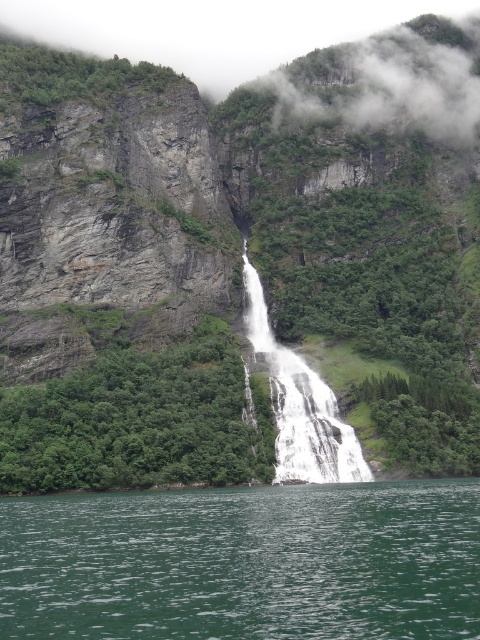
Question: Observing the image, what is the correct spatial positioning of green liquid water at center in reference to white smooth waterfall at center?

Choices:
 (A) above
 (B) below

Answer: (B)

Question: Does green liquid water at center appear under white smooth waterfall at center?

Choices:
 (A) no
 (B) yes

Answer: (B)

Question: Which point appears closest to the camera in this image?

Choices:
 (A) (252, 330)
 (B) (72, 579)

Answer: (B)

Question: Which object appears farthest from the camera in this image?

Choices:
 (A) white smooth waterfall at center
 (B) green liquid water at center

Answer: (A)

Question: Can you confirm if green liquid water at center is bigger than white smooth waterfall at center?

Choices:
 (A) no
 (B) yes

Answer: (A)

Question: Which point is closer to the camera taking this photo?

Choices:
 (A) (372, 570)
 (B) (296, 356)

Answer: (A)